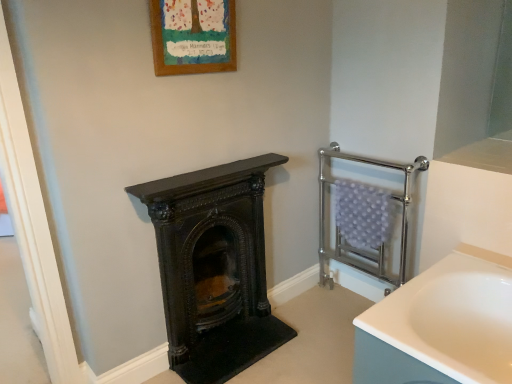
This screenshot has width=512, height=384. What are the coordinates of `vacant space to the right of black polished wood burning stove at center` in the screenshot? It's located at (302, 349).